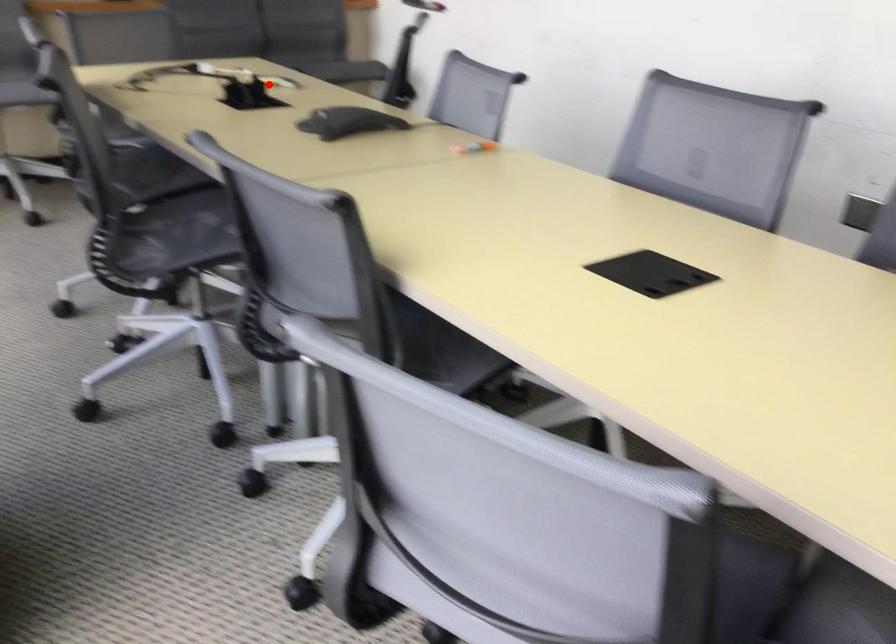
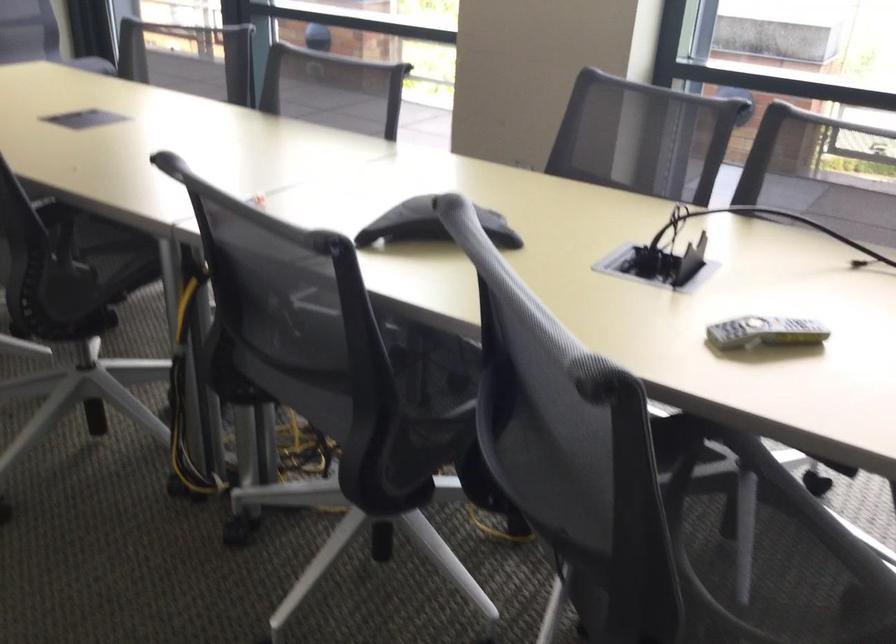
Find the pixel in the second image that matches the highlighted location in the first image.

(764, 332)